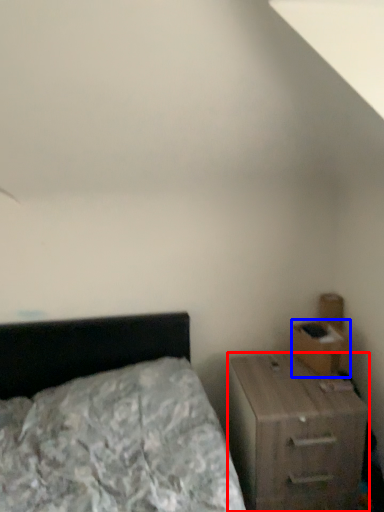
Question: Which point is closer to the camera, nightstand (highlighted by a red box) or drawer (highlighted by a blue box)?

Choices:
 (A) nightstand
 (B) drawer

Answer: (A)